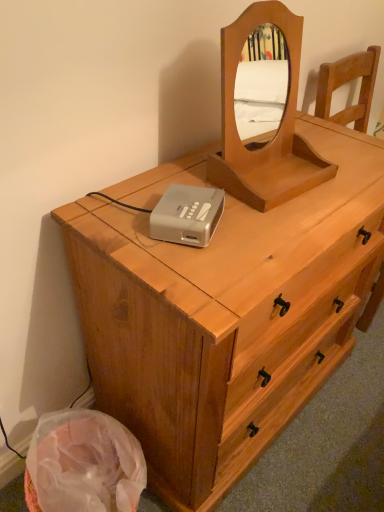
At what (x,y) coordinates should I click in order to perform the action: click on silver plastic cassette at center. Please return your answer as a coordinate pair (x, y). The image size is (384, 512). Looking at the image, I should click on (187, 215).

Find the location of a particular element. The height and width of the screenshot is (512, 384). light brown wooden mirror at upper center is located at coordinates (277, 130).

What do you see at coordinates (226, 316) in the screenshot? I see `light brown wood chest of drawers at center` at bounding box center [226, 316].

You are a GUI agent. You are given a task and a screenshot of the screen. Output one action in this format:
    pyautogui.click(x=<x>, y=<y>)
    Task: Click on the light brown wood chest of drawers at center
    
    Given the screenshot: What is the action you would take?
    pyautogui.click(x=226, y=316)

Identify the location of silver plastic cassette at center. This screenshot has width=384, height=512. pos(187,215).

Is point (187, 234) behind point (301, 215)?

No, (187, 234) is in front of (301, 215).

Relative to light brown wood chest of drawers at center, is silver plastic cassette at center in front or behind?

Visually, silver plastic cassette at center is located behind light brown wood chest of drawers at center.

Visually, is silver plastic cassette at center positioned to the left or to the right of light brown wood chest of drawers at center?

From the image, it's evident that silver plastic cassette at center is to the left of light brown wood chest of drawers at center.

Between silver plastic cassette at center and light brown wooden mirror at upper center, which one appears on the right side from the viewer's perspective?

From the viewer's perspective, light brown wooden mirror at upper center appears more on the right side.

Is silver plastic cassette at center not inside light brown wooden mirror at upper center?

Indeed, silver plastic cassette at center is completely outside light brown wooden mirror at upper center.

This screenshot has width=384, height=512. I want to click on mirror located above the silver plastic cassette at center (from a real-world perspective), so click(x=277, y=130).

Can you see silver plastic cassette at center touching light brown wooden mirror at upper center?

No, silver plastic cassette at center is not touching light brown wooden mirror at upper center.

From a real-world perspective, is light brown wooden mirror at upper center over silver plastic cassette at center?

Indeed, from a real-world perspective, light brown wooden mirror at upper center stands above silver plastic cassette at center.

Is light brown wooden mirror at upper center positioned behind silver plastic cassette at center?

No, it is not.

Considering the relative sizes of light brown wooden mirror at upper center and silver plastic cassette at center in the image provided, is light brown wooden mirror at upper center taller than silver plastic cassette at center?

Yes.

Can you tell me how much light brown wood chest of drawers at center and silver plastic cassette at center differ in facing direction?

The facing directions of light brown wood chest of drawers at center and silver plastic cassette at center are 27.2 degrees apart.

Based on the photo, which object is positioned more to the left, light brown wood chest of drawers at center or silver plastic cassette at center?

From the viewer's perspective, silver plastic cassette at center appears more on the left side.

Who is shorter, light brown wood chest of drawers at center or silver plastic cassette at center?

silver plastic cassette at center is shorter.

From the image's perspective, would you say light brown wood chest of drawers at center is positioned over silver plastic cassette at center?

No, from the image's perspective, light brown wood chest of drawers at center is not over silver plastic cassette at center.

Is light brown wooden mirror at upper center at the right side of light brown wood chest of drawers at center?

Correct, you'll find light brown wooden mirror at upper center to the right of light brown wood chest of drawers at center.

Is point (271, 162) positioned after point (244, 442)?

No, it is not.

Does light brown wooden mirror at upper center touch light brown wood chest of drawers at center?

They are not placed beside each other.

Can you confirm if light brown wooden mirror at upper center is bigger than light brown wood chest of drawers at center?

Incorrect, light brown wooden mirror at upper center is not larger than light brown wood chest of drawers at center.

Which object is closer to the camera, light brown wood chest of drawers at center or light brown wooden mirror at upper center?

light brown wood chest of drawers at center is closer to the camera.

Is light brown wood chest of drawers at center positioned far away from light brown wooden mirror at upper center?

Actually, light brown wood chest of drawers at center and light brown wooden mirror at upper center are a little close together.

Is light brown wood chest of drawers at center inside the boundaries of light brown wooden mirror at upper center, or outside?

light brown wood chest of drawers at center is outside light brown wooden mirror at upper center.

This screenshot has height=512, width=384. Find the location of `chest of drawers below the silver plastic cassette at center (from the image's perspective)`. chest of drawers below the silver plastic cassette at center (from the image's perspective) is located at coordinates (226, 316).

The image size is (384, 512). Identify the location of mirror to the right of silver plastic cassette at center. (277, 130).

Estimate the real-world distances between objects in this image. Which object is closer to silver plastic cassette at center, light brown wooden mirror at upper center or light brown wood chest of drawers at center?

Based on the image, light brown wooden mirror at upper center appears to be nearer to silver plastic cassette at center.

From the image, which object appears to be nearer to light brown wood chest of drawers at center, silver plastic cassette at center or light brown wooden mirror at upper center?

Among the two, light brown wooden mirror at upper center is located nearer to light brown wood chest of drawers at center.

Estimate the real-world distances between objects in this image. Which object is closer to silver plastic cassette at center, light brown wood chest of drawers at center or light brown wooden mirror at upper center?

light brown wooden mirror at upper center is positioned closer to the anchor silver plastic cassette at center.

Based on their spatial positions, is light brown wooden mirror at upper center or silver plastic cassette at center closer to light brown wood chest of drawers at center?

The object closer to light brown wood chest of drawers at center is light brown wooden mirror at upper center.

Looking at the image, which one is located further to light brown wooden mirror at upper center, silver plastic cassette at center or light brown wood chest of drawers at center?

Among the two, light brown wood chest of drawers at center is located further to light brown wooden mirror at upper center.

Looking at the image, which one is located closer to light brown wooden mirror at upper center, light brown wood chest of drawers at center or silver plastic cassette at center?

The object closer to light brown wooden mirror at upper center is silver plastic cassette at center.

Where is `cassette between light brown wooden mirror at upper center and light brown wood chest of drawers at center in the vertical direction`? cassette between light brown wooden mirror at upper center and light brown wood chest of drawers at center in the vertical direction is located at coordinates (187, 215).